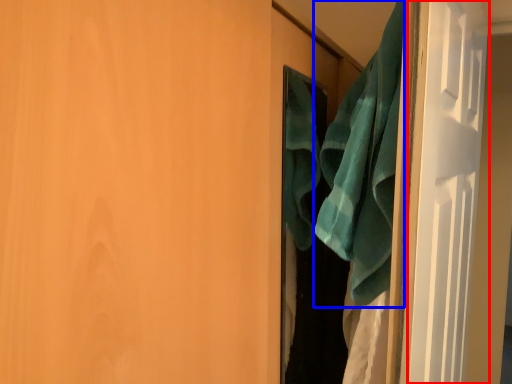
Question: Which of the following is the farthest to the observer, screen door (highlighted by a red box) or beach towel (highlighted by a blue box)?

Choices:
 (A) screen door
 (B) beach towel

Answer: (B)